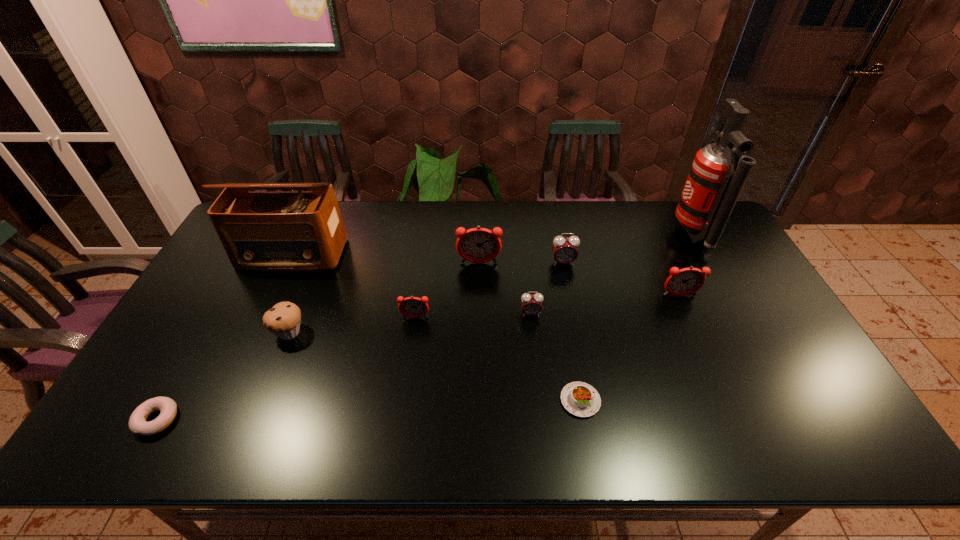
Identify the location of pudding that is at the near edge. This screenshot has width=960, height=540. (580, 399).

The height and width of the screenshot is (540, 960). What are the coordinates of `doughnut situated at the near edge` in the screenshot? It's located at tap(138, 425).

You are a GUI agent. You are given a task and a screenshot of the screen. Output one action in this format:
    pyautogui.click(x=<x>, y=<y>)
    Task: Click on the radio receiver at the left edge
    This screenshot has height=540, width=960.
    Given the screenshot: What is the action you would take?
    pyautogui.click(x=290, y=231)

This screenshot has height=540, width=960. I want to click on doughnut that is at the left edge, so click(x=138, y=425).

Find the location of a particular element. The height and width of the screenshot is (540, 960). object located at the right edge is located at coordinates (718, 174).

Where is `object that is positioned at the far left corner`? Image resolution: width=960 pixels, height=540 pixels. object that is positioned at the far left corner is located at coordinates (290, 231).

I want to click on object situated at the near left corner, so click(x=138, y=425).

The width and height of the screenshot is (960, 540). I want to click on object located at the far right corner, so click(x=718, y=174).

The height and width of the screenshot is (540, 960). In the image, there is a desktop. In order to click on blank space at the far edge in this screenshot , I will do `click(439, 210)`.

In the image, there is a desktop. What are the coordinates of `vacant space at the near edge` in the screenshot? It's located at (738, 441).